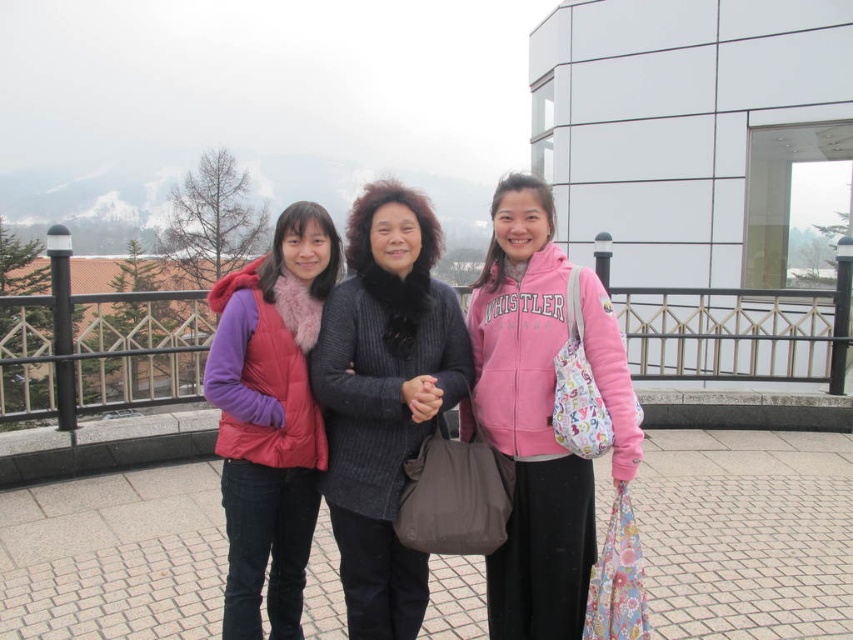
Who is more forward, (428,397) or (520,403)?

Point (428,397)

Between point (393, 620) and point (531, 381), which one is positioned behind?

Point (393, 620)

Describe the element at coordinates (384, 397) in the screenshot. I see `knitted gray sweater at center` at that location.

Find the location of `knitted gray sweater at center`. knitted gray sweater at center is located at coordinates (384, 397).

Can you confirm if knitted gray sweater at center is wider than matte pink vest at left?

No, knitted gray sweater at center is not wider than matte pink vest at left.

Locate an element on the screen. The height and width of the screenshot is (640, 853). knitted gray sweater at center is located at coordinates (384, 397).

Measure the distance between point [374,538] and camera.

Point [374,538] is 2.94 meters away from camera.

The width and height of the screenshot is (853, 640). What are the coordinates of `knitted gray sweater at center` in the screenshot? It's located at point(384,397).

Can you confirm if pink fleece jacket at center is positioned below matte pink vest at left?

Actually, pink fleece jacket at center is above matte pink vest at left.

Between pink fleece jacket at center and matte pink vest at left, which one has less height?

Standing shorter between the two is matte pink vest at left.

The width and height of the screenshot is (853, 640). I want to click on pink fleece jacket at center, so click(529, 420).